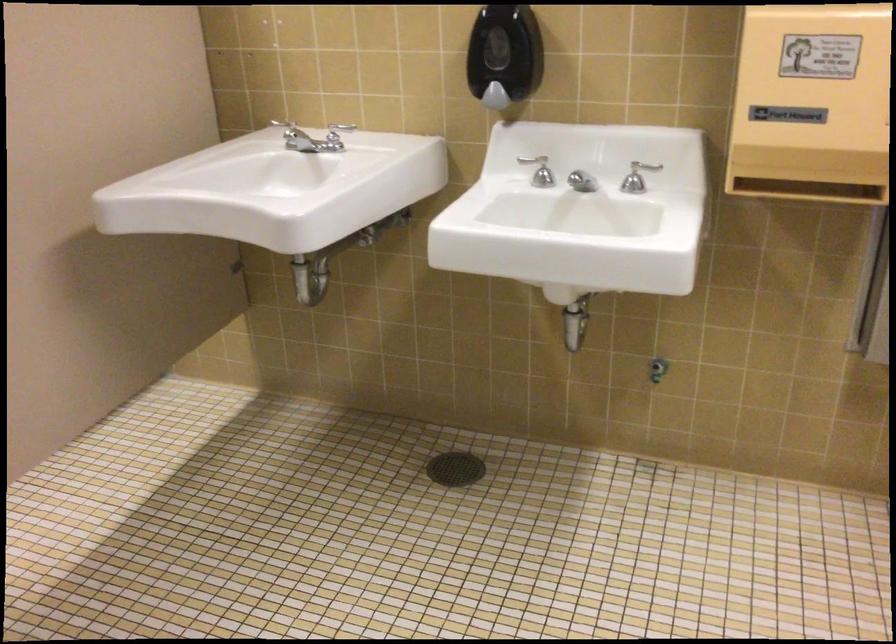
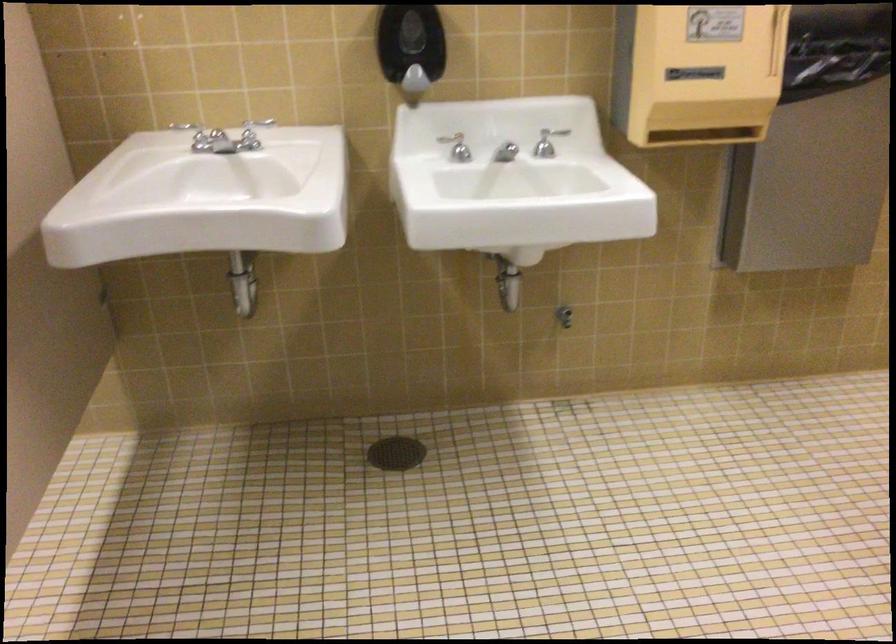
The point at [494,102] is marked in the first image. Where is the corresponding point in the second image?

(412, 84)